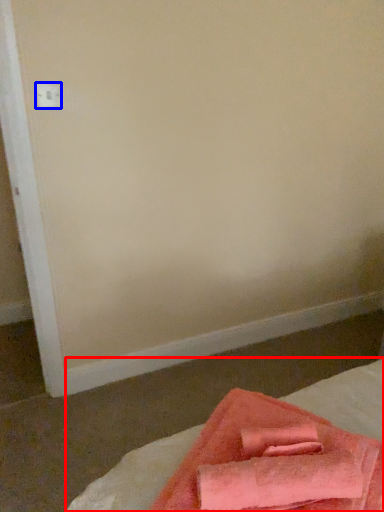
Question: Among these objects, which one is nearest to the camera, bed (highlighted by a red box) or electric outlet (highlighted by a blue box)?

Choices:
 (A) bed
 (B) electric outlet

Answer: (A)